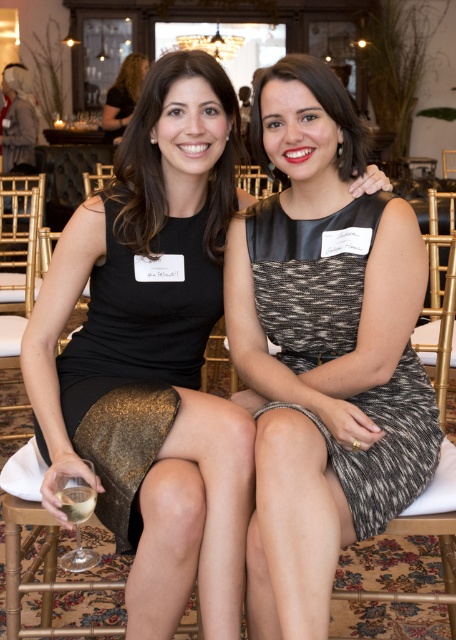
Question: Observing the image, what is the correct spatial positioning of black leather dress at left in reference to speckled jersey dress at center?

Choices:
 (A) below
 (B) above

Answer: (A)

Question: Which object appears closest to the camera in this image?

Choices:
 (A) matte black dress at center
 (B) speckled jersey dress at center
 (C) clear glass wine glass at lower left

Answer: (C)

Question: Observing the image, what is the correct spatial positioning of black leather dress at left in reference to translucent glass at lower left?

Choices:
 (A) right
 (B) left

Answer: (A)

Question: Which point is closer to the camera?

Choices:
 (A) (434, 404)
 (B) (172, 376)

Answer: (A)

Question: Does speckled jersey dress at center have a lesser width compared to matte black dress at center?

Choices:
 (A) yes
 (B) no

Answer: (A)

Question: Which of the following is the farthest from the observer?

Choices:
 (A) (433, 461)
 (B) (72, 512)
 (C) (139, 416)

Answer: (A)